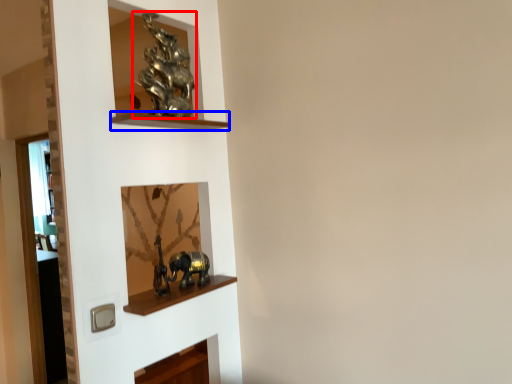
Question: Which object is closer to the camera taking this photo, art (highlighted by a red box) or cabinet (highlighted by a blue box)?

Choices:
 (A) art
 (B) cabinet

Answer: (B)